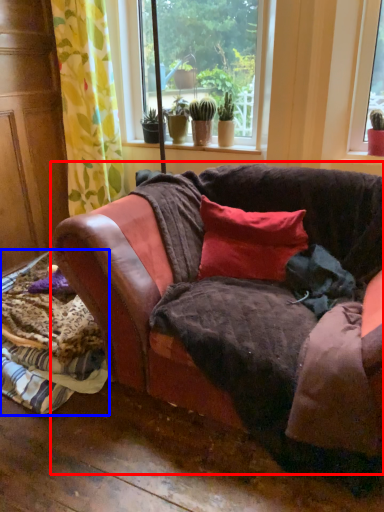
Question: Which point is further to the camera, studio couch (highlighted by a red box) or material (highlighted by a blue box)?

Choices:
 (A) studio couch
 (B) material

Answer: (B)